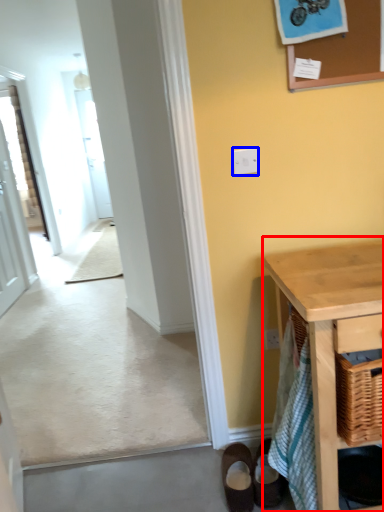
Question: Which object appears farthest to the camera in this image, table (highlighted by a red box) or light switch (highlighted by a blue box)?

Choices:
 (A) table
 (B) light switch

Answer: (B)